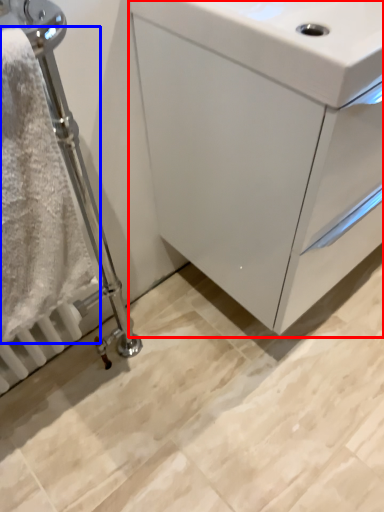
Question: Which object is further to the camera taking this photo, bathroom cabinet (highlighted by a red box) or bath towel (highlighted by a blue box)?

Choices:
 (A) bathroom cabinet
 (B) bath towel

Answer: (A)